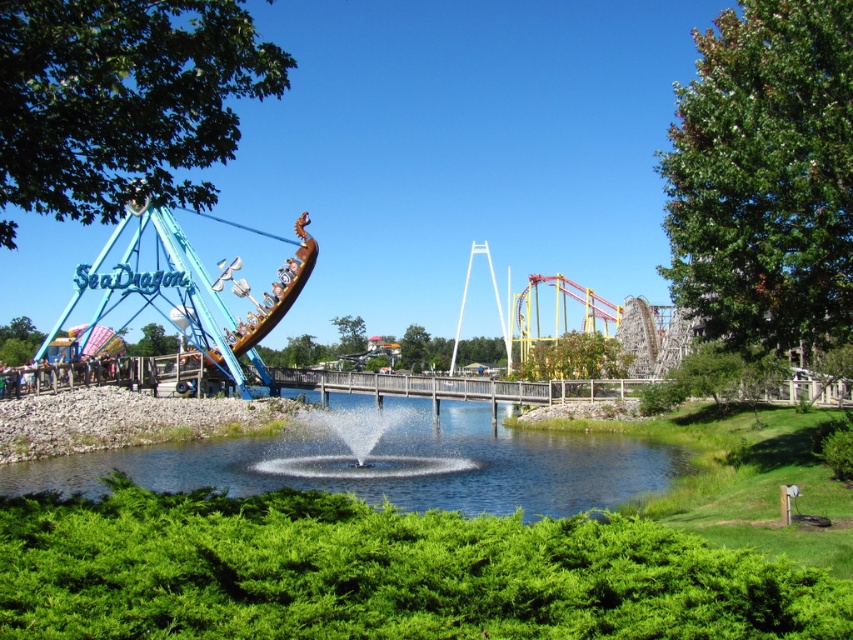
Between point (410, 502) and point (148, 220), which one is positioned behind?

Point (148, 220)

You are a GUI agent. You are given a task and a screenshot of the screen. Output one action in this format:
    pyautogui.click(x=<x>, y=<y>)
    Task: Click on the clear water at center
    This screenshot has width=853, height=640.
    Given the screenshot: What is the action you would take?
    pyautogui.click(x=389, y=461)